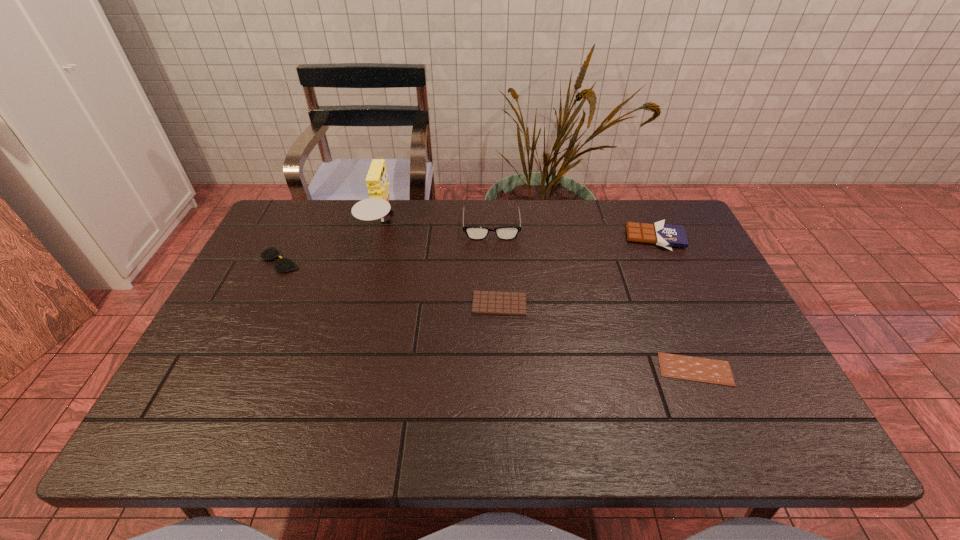
At what (x,y) coordinates should I click in order to perform the action: click on the nearest chocolate bar. Please return your answer as a coordinate pair (x, y). The image size is (960, 540). Looking at the image, I should click on pyautogui.click(x=690, y=368).

The image size is (960, 540). Find the location of `the shortest chocolate bar`. the shortest chocolate bar is located at coordinates pyautogui.click(x=690, y=368).

Where is `vacant space located 0.200m on the front-facing side of the sponge`? This screenshot has height=540, width=960. vacant space located 0.200m on the front-facing side of the sponge is located at coordinates (463, 226).

At what (x,y) coordinates should I click in order to perform the action: click on vacant area situated 0.060m on the front-facing side of the fifth shortest object. Please return your answer as a coordinate pair (x, y). Looking at the image, I should click on (492, 254).

What are the coordinates of `vacant space situated 0.140m on the back of the tallest chocolate bar` in the screenshot? It's located at (638, 200).

This screenshot has width=960, height=540. Identify the location of free region located 0.200m on the front of the shorter spectacles. (248, 329).

Where is `free space located 0.090m on the right of the second shortest object`? The width and height of the screenshot is (960, 540). free space located 0.090m on the right of the second shortest object is located at coordinates (562, 304).

Where is `free location located on the left of the shortest object`? free location located on the left of the shortest object is located at coordinates (498, 369).

In order to click on sponge that is at the far edge in this screenshot , I will do `click(377, 206)`.

The height and width of the screenshot is (540, 960). In order to click on spectacles that is positioned at the far edge in this screenshot , I will do `click(473, 232)`.